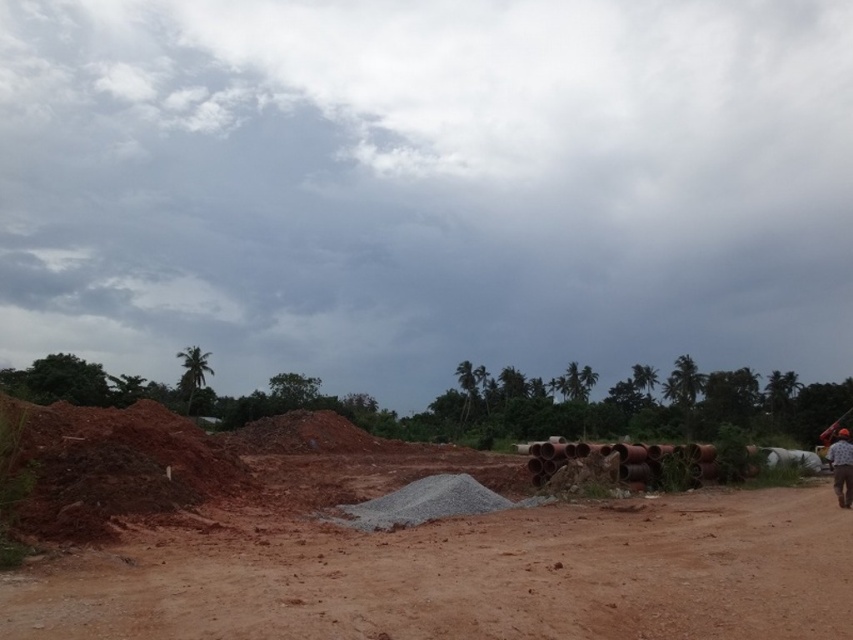
Question: Where is brown dirt field at center located in relation to brown fabric shirt at lower right in the image?

Choices:
 (A) right
 (B) left

Answer: (B)

Question: Which object appears farthest from the camera in this image?

Choices:
 (A) brown fabric shirt at lower right
 (B) brown dirt field at center

Answer: (A)

Question: In this image, where is brown dirt field at center located relative to brown fabric shirt at lower right?

Choices:
 (A) left
 (B) right

Answer: (A)

Question: Which point is farther to the camera?

Choices:
 (A) brown dirt field at center
 (B) brown fabric shirt at lower right

Answer: (B)

Question: Can you confirm if brown dirt field at center is smaller than brown fabric shirt at lower right?

Choices:
 (A) yes
 (B) no

Answer: (A)

Question: Which of the following is the closest to the observer?

Choices:
 (A) brown fabric shirt at lower right
 (B) brown dirt field at center

Answer: (B)